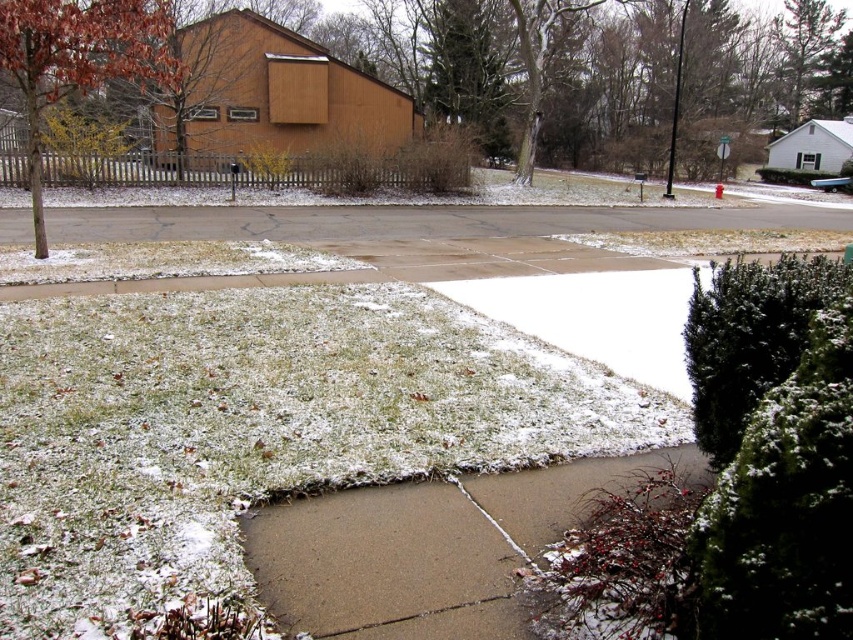
Question: Is brown concrete sidewalk at lower center positioned before reddish-brown bark tree at left?

Choices:
 (A) no
 (B) yes

Answer: (B)

Question: Among these points, which one is farthest from the camera?

Choices:
 (A) (39, 100)
 (B) (618, 460)

Answer: (A)

Question: Can you confirm if brown concrete sidewalk at lower center is positioned to the left of reddish-brown bark tree at left?

Choices:
 (A) yes
 (B) no

Answer: (B)

Question: Which point is farther to the camera?

Choices:
 (A) brown concrete sidewalk at lower center
 (B) reddish-brown bark tree at left

Answer: (B)

Question: Is brown concrete sidewalk at lower center to the right of reddish-brown bark tree at left from the viewer's perspective?

Choices:
 (A) no
 (B) yes

Answer: (B)